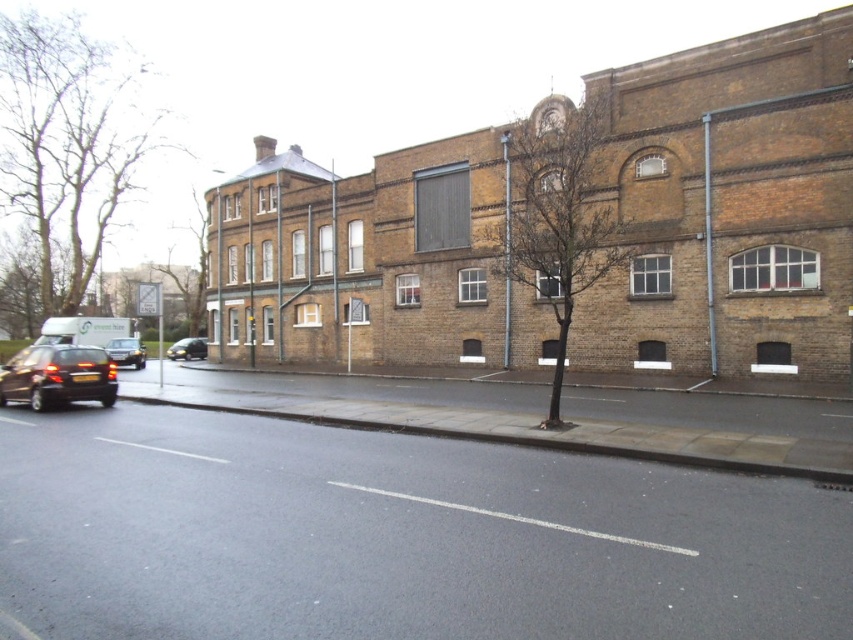
Who is lower down, shiny black car at lower left or shiny black car at left?

shiny black car at left is below.

Does shiny black car at lower left have a lesser height compared to shiny black car at left?

Yes, shiny black car at lower left is shorter than shiny black car at left.

Which is in front, point (41, 362) or point (109, 356)?

Point (41, 362)

What are the coordinates of `shiny black car at lower left` in the screenshot? It's located at (57, 376).

Who is lower down, shiny black car at lower left or shiny black car at center-left?

Positioned lower is shiny black car at center-left.

Is point (51, 378) farther from camera compared to point (177, 356)?

No, it is in front of (177, 356).

Locate an element on the screen. Image resolution: width=853 pixels, height=640 pixels. shiny black car at lower left is located at coordinates (57, 376).

This screenshot has width=853, height=640. Find the location of `shiny black car at lower left`. shiny black car at lower left is located at coordinates (57, 376).

Locate an element on the screen. The height and width of the screenshot is (640, 853). shiny black car at lower left is located at coordinates (57, 376).

Who is more distant from viewer, (62,385) or (146,314)?

Positioned behind is point (146,314).

Where is `shiny black car at lower left`? shiny black car at lower left is located at coordinates (57, 376).